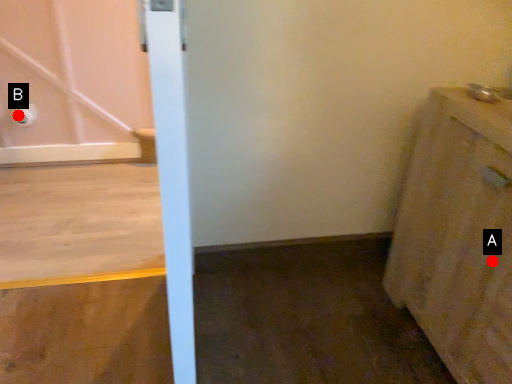
Question: Two points are circled on the image, labeled by A and B beside each circle. Which of the following is the farthest from the observer?

Choices:
 (A) A is further
 (B) B is further

Answer: (B)